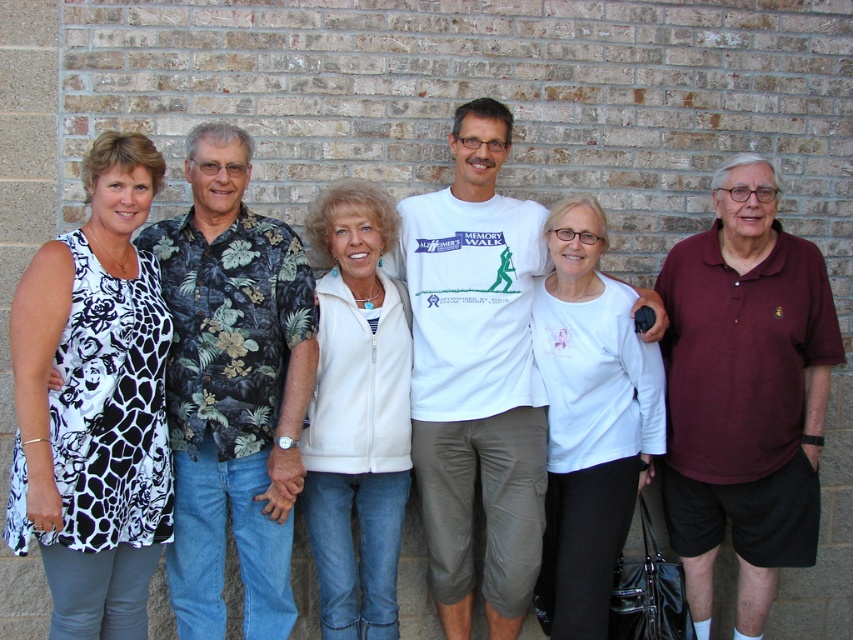
What is the 2D coordinate of the black printed fabric dress at left in the image?

The 2D coordinate of the black printed fabric dress at left is at point (x=94, y=403).

You are organizing a photo shoot and need to arrange two models from the image. The first model is wearing a black printed fabric dress at left, and the second is wearing a white matte shirt at center. Which model should you place on the left side if you want them to mirror their original positions?

The black printed fabric dress at left should be placed on the left side to mirror their original positions since it was originally positioned on the left side of the white matte shirt at center.

You are a photographer setting up for a group photo. You need to ensure that the maroon polo shirt at right and the white fleece vest at center are within a 5 feet distance to frame them properly. Based on the scene description, can you confirm if they are close enough?

The distance between the maroon polo shirt at right and the white fleece vest at center is 4.54 feet, which is within the 5 feet requirement. Therefore, they are close enough to be framed properly.